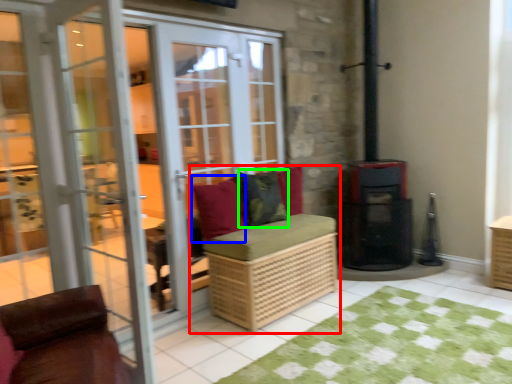
Question: Which is farther away from furniture (highlighted by a red box)? pillow (highlighted by a blue box) or pillow (highlighted by a green box)?

Choices:
 (A) pillow
 (B) pillow

Answer: (B)